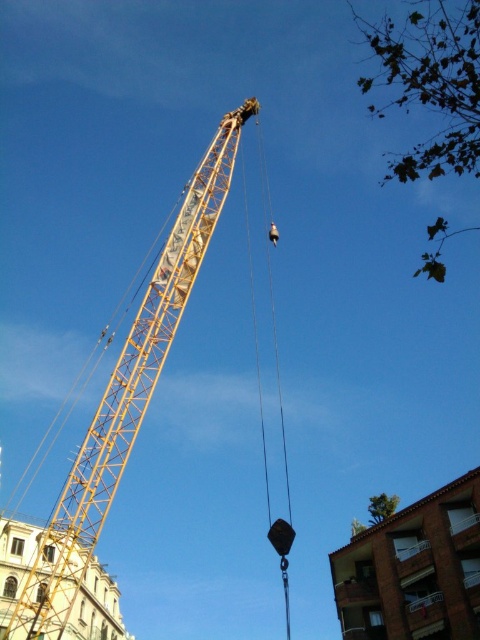
Question: Considering the relative positions of yellow metallic crane at center and black rubber lift at center in the image provided, where is yellow metallic crane at center located with respect to black rubber lift at center?

Choices:
 (A) left
 (B) right

Answer: (A)

Question: Which of the following is the closest to the observer?

Choices:
 (A) (x=272, y=528)
 (B) (x=109, y=476)

Answer: (B)

Question: Which object is closer to the camera taking this photo?

Choices:
 (A) yellow metallic crane at center
 (B) black rubber lift at center

Answer: (A)

Question: Does yellow metallic crane at center have a greater width compared to black rubber lift at center?

Choices:
 (A) yes
 (B) no

Answer: (A)

Question: Is yellow metallic crane at center bigger than black rubber lift at center?

Choices:
 (A) no
 (B) yes

Answer: (B)